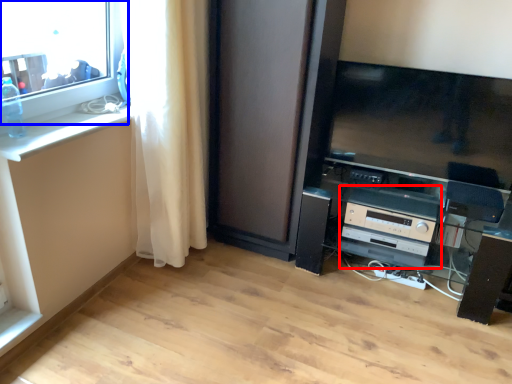
Question: Which point is further to the camera, appliance (highlighted by a red box) or window (highlighted by a blue box)?

Choices:
 (A) appliance
 (B) window

Answer: (A)